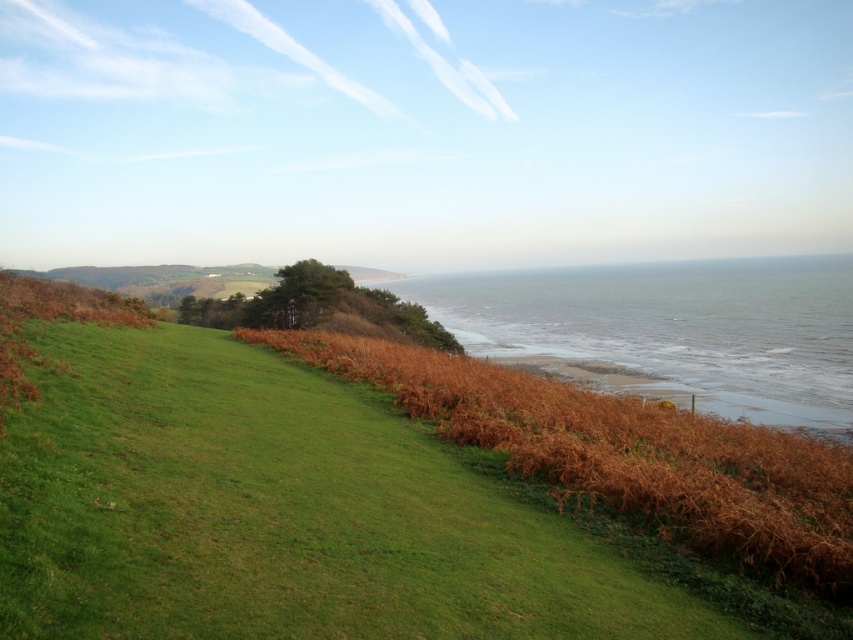
Is point (9, 483) positioned behind point (827, 368)?

No, (9, 483) is in front of (827, 368).

Which is above, green grass at lower left or grayish-green water at lower center?

Positioned higher is grayish-green water at lower center.

This screenshot has width=853, height=640. What do you see at coordinates (277, 512) in the screenshot?
I see `green grass at lower left` at bounding box center [277, 512].

Where is `green grass at lower left`? green grass at lower left is located at coordinates (277, 512).